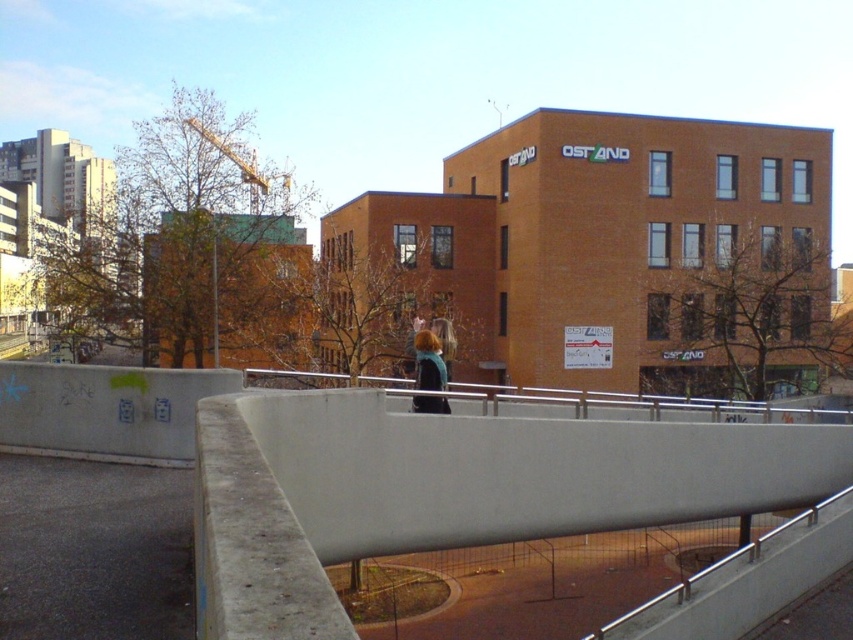
Who is more forward, (306, 564) or (433, 371)?

Point (306, 564) is more forward.

The image size is (853, 640). I want to click on concrete at center, so [x=253, y=536].

You are a GUI agent. You are given a task and a screenshot of the screen. Output one action in this format:
    pyautogui.click(x=<x>, y=<y>)
    Task: Click on the concrete at center
    The height and width of the screenshot is (640, 853).
    Given the screenshot: What is the action you would take?
    [x=253, y=536]